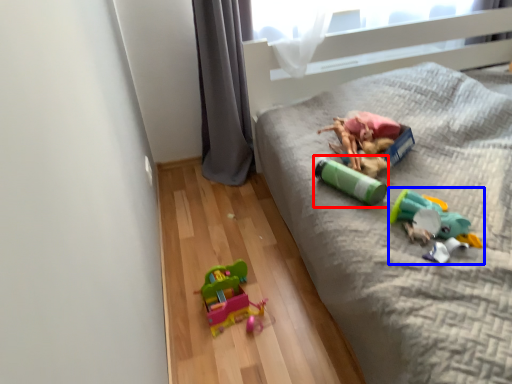
Question: Which point is further to the camera, toy (highlighted by a red box) or toy (highlighted by a blue box)?

Choices:
 (A) toy
 (B) toy

Answer: (A)